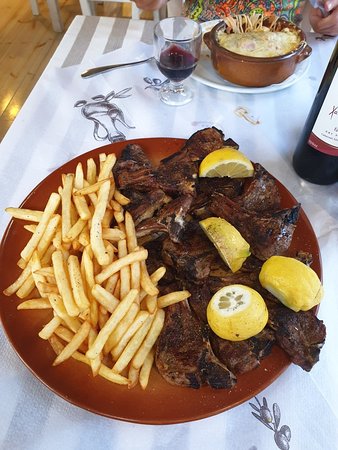
Where is `plate`? The width and height of the screenshot is (338, 450). plate is located at coordinates (174, 400).